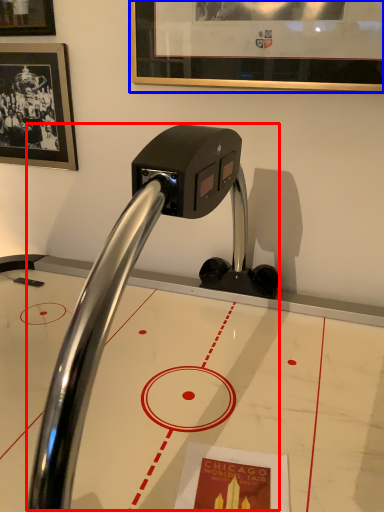
Question: Which object is further to the camera taking this photo, faucet (highlighted by a red box) or picture frame (highlighted by a blue box)?

Choices:
 (A) faucet
 (B) picture frame

Answer: (B)